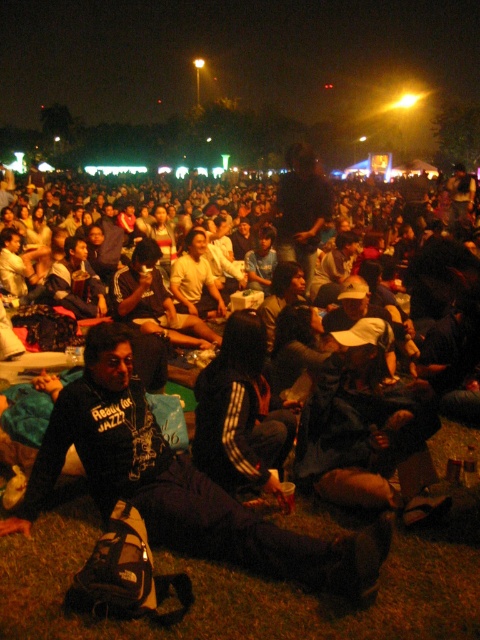
Can you confirm if black matte jacket at lower left is wider than black fleece jacket at center?

Yes.

Between black matte jacket at lower left and black fleece jacket at center, which one has less height?

Standing shorter between the two is black fleece jacket at center.

What do you see at coordinates (177, 483) in the screenshot?
I see `black matte jacket at lower left` at bounding box center [177, 483].

Identify the location of black matte jacket at lower left. This screenshot has height=640, width=480. (177, 483).

Does black fabric crowd at lower left have a greater width compared to black fleece jacket at center?

Yes.

Who is positioned more to the left, black fabric crowd at lower left or black fleece jacket at center?

black fleece jacket at center

Where is `black fabric crowd at lower left`? black fabric crowd at lower left is located at coordinates (436, 323).

What are the coordinates of `black fabric crowd at lower left` in the screenshot? It's located at (436, 323).

Which of these two, black fabric crowd at lower left or black matte jacket at lower left, stands taller?

Standing taller between the two is black fabric crowd at lower left.

Is point (346, 237) positioned before point (76, 400)?

No, it is behind (76, 400).

From the picture: Who is more forward, [322,310] or [205,550]?

Point [205,550] is more forward.

Locate an element on the screen. black fabric crowd at lower left is located at coordinates (436, 323).